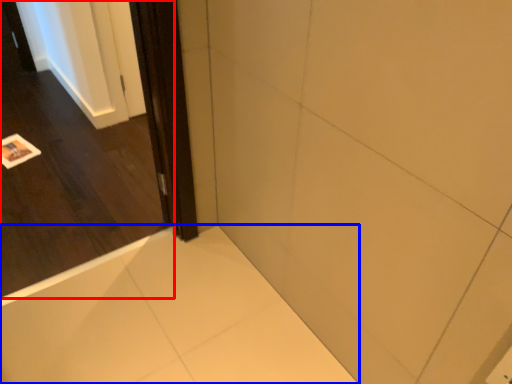
Question: Which object is further to the camera taking this photo, door (highlighted by a red box) or bath (highlighted by a blue box)?

Choices:
 (A) door
 (B) bath

Answer: (B)